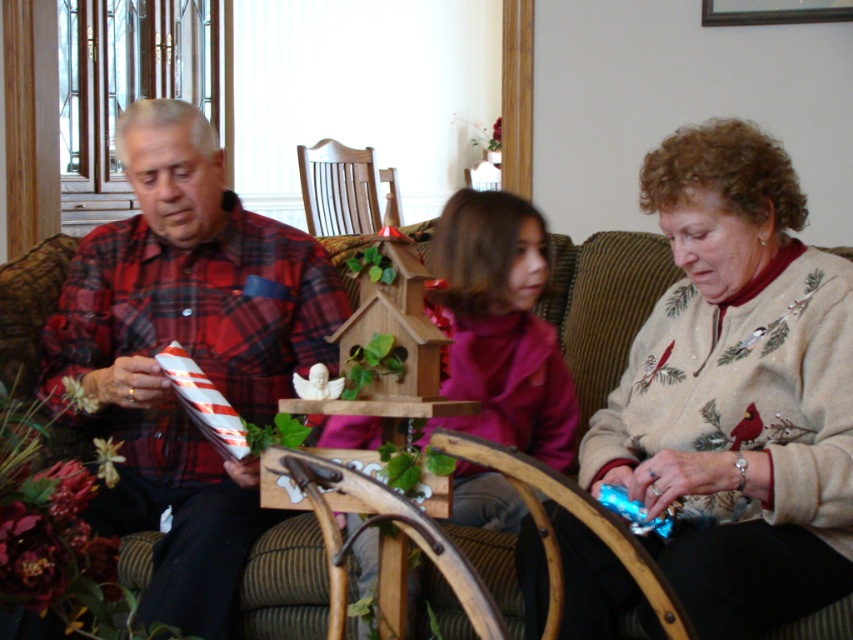
Can you confirm if beige embroidered sweater at right is positioned to the right of brown fabric couch at center?

Yes, beige embroidered sweater at right is to the right of brown fabric couch at center.

Describe the element at coordinates (738, 388) in the screenshot. The width and height of the screenshot is (853, 640). I see `beige embroidered sweater at right` at that location.

This screenshot has width=853, height=640. Identify the location of beige embroidered sweater at right. (738, 388).

Where is `beige embroidered sweater at right`? Image resolution: width=853 pixels, height=640 pixels. beige embroidered sweater at right is located at coordinates (738, 388).

Can you confirm if red plaid shirt at left is positioned to the left of brown fabric couch at center?

Correct, you'll find red plaid shirt at left to the left of brown fabric couch at center.

Does red plaid shirt at left have a smaller size compared to brown fabric couch at center?

Incorrect, red plaid shirt at left is not smaller in size than brown fabric couch at center.

Does point (115, 333) come behind point (158, 532)?

Yes.

In order to click on red plaid shirt at left in this screenshot , I will do (187, 352).

Who is positioned more to the right, red plaid shirt at left or wooden rocking chair at center?

wooden rocking chair at center

Who is lower down, red plaid shirt at left or wooden rocking chair at center?

Positioned lower is red plaid shirt at left.

Does point (108, 262) lie in front of point (312, 147)?

Yes, it is in front of point (312, 147).

Locate an element on the screen. The height and width of the screenshot is (640, 853). red plaid shirt at left is located at coordinates (187, 352).